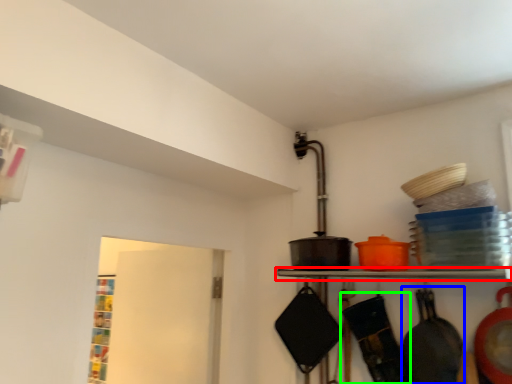
Question: Based on their relative distances, which object is nearer to shelf (highlighted by a red box)? Choose from frying pan (highlighted by a blue box) and frying pan (highlighted by a green box).

Choices:
 (A) frying pan
 (B) frying pan

Answer: (B)